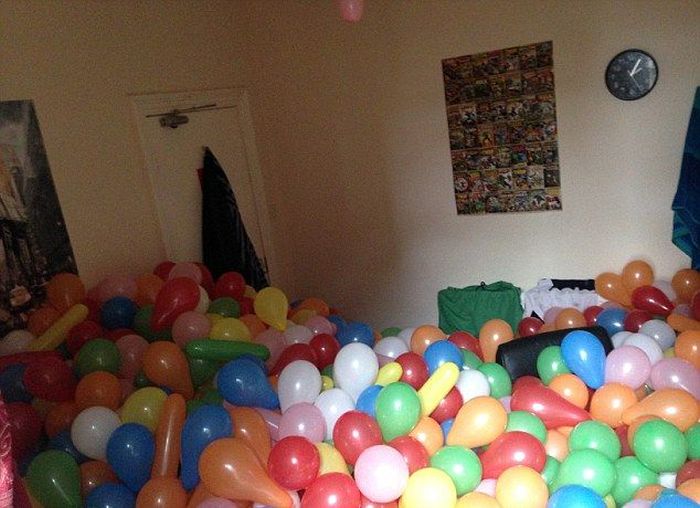
Identify the location of door closer. (172, 117).